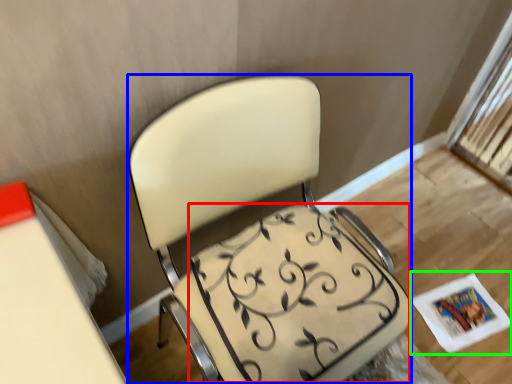
Question: Which is nearer to the swivel chair (highlighted by a red box)? chair (highlighted by a blue box) or magazine (highlighted by a green box).

Choices:
 (A) chair
 (B) magazine

Answer: (A)